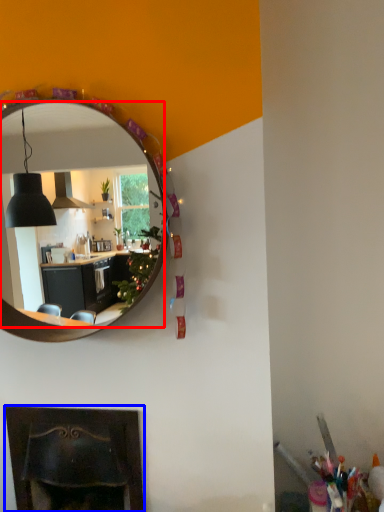
Question: Which object appears closest to the camera in this image, mirror (highlighted by a red box) or fireplace (highlighted by a blue box)?

Choices:
 (A) mirror
 (B) fireplace

Answer: (A)